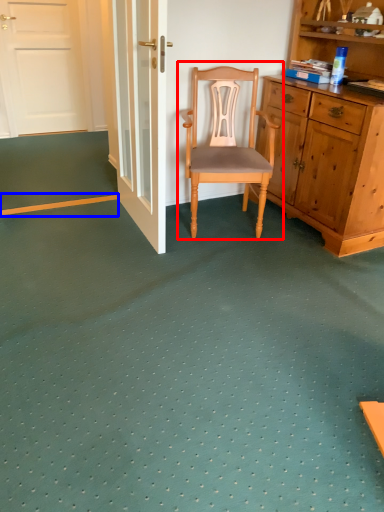
Question: Which of the following is the farthest to the observer, chair (highlighted by a red box) or strip (highlighted by a blue box)?

Choices:
 (A) chair
 (B) strip

Answer: (B)